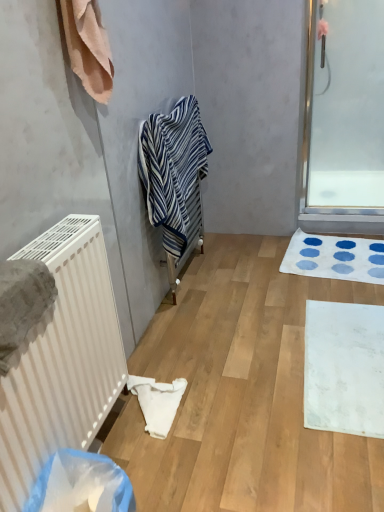
The height and width of the screenshot is (512, 384). I want to click on vacant area on top of white matte radiator at left (from a real-world perspective), so click(278, 320).